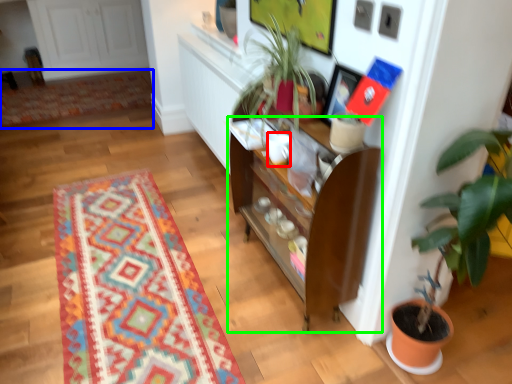
Question: Based on their relative distances, which object is nearer to coffee cup (highlighted by a red box)? Choose from mat (highlighted by a blue box) and cabinetry (highlighted by a green box).

Choices:
 (A) mat
 (B) cabinetry

Answer: (B)